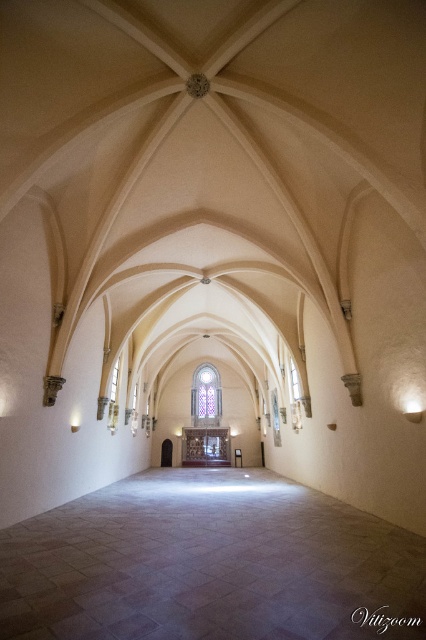
Looking at this image, which is below, stained glass window at center or transparent glass window at center?

stained glass window at center is below.

Measure the distance between stained glass window at center and transparent glass window at center.

stained glass window at center and transparent glass window at center are 12.33 meters apart from each other.

Where is `stained glass window at center`? This screenshot has width=426, height=640. stained glass window at center is located at coordinates (206, 394).

Locate an element on the screen. stained glass window at center is located at coordinates (206, 394).